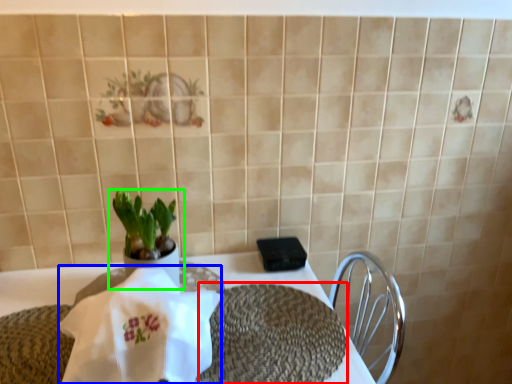
Question: Estimate the real-world distances between objects in this image. Which object is closer to place mat (highlighted by a red box), cloth (highlighted by a blue box) or houseplant (highlighted by a green box)?

Choices:
 (A) cloth
 (B) houseplant

Answer: (A)